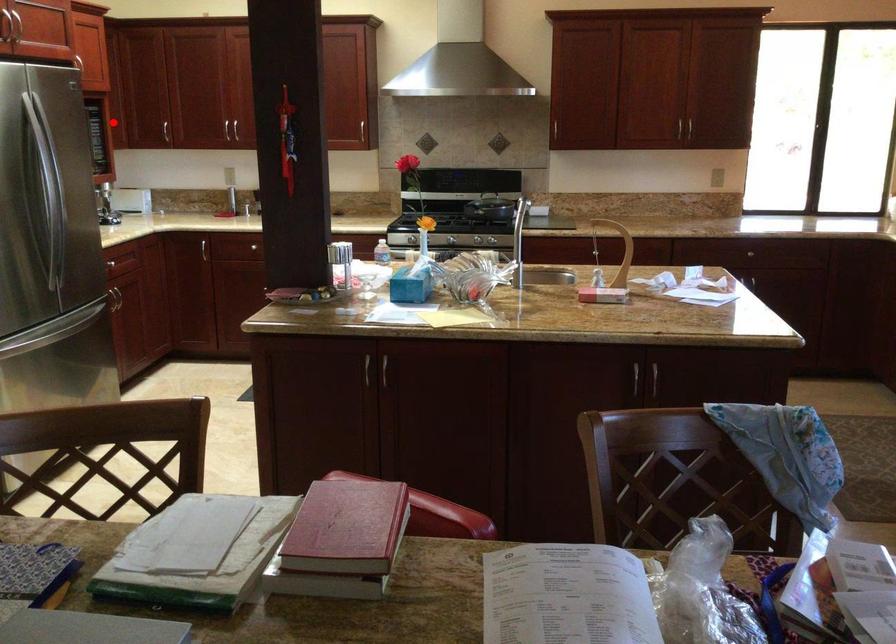
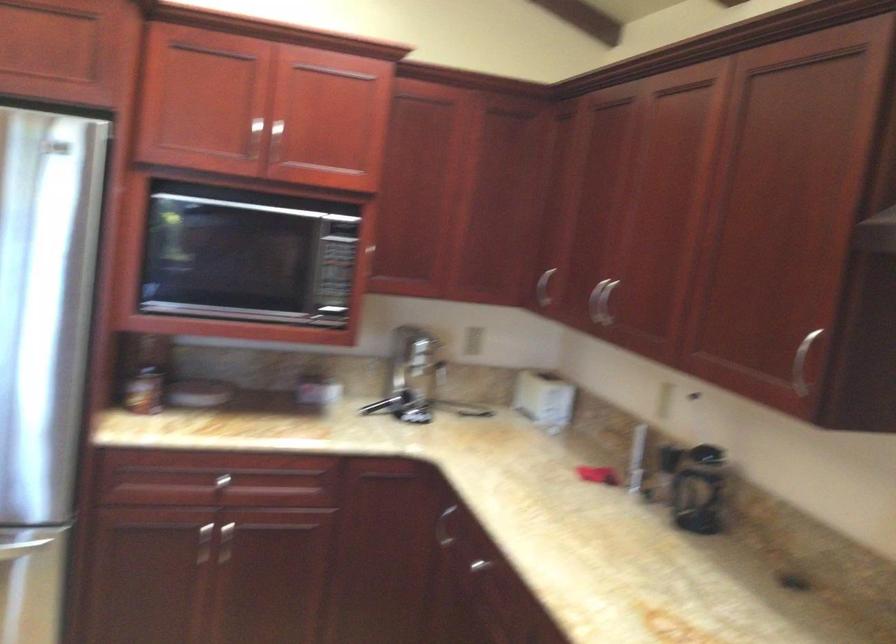
Where in the second image is the point corresponding to the highlighted location from the first image?

(544, 287)